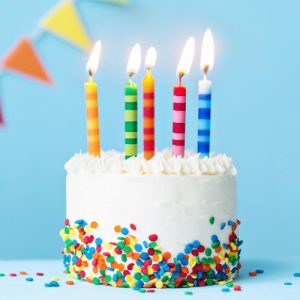
You are a GUI agent. You are given a task and a screenshot of the screen. Output one action in this format:
    pyautogui.click(x=<x>, y=<y>)
    Task: Click on the candle
    
    Given the screenshot: What is the action you would take?
    pyautogui.click(x=88, y=130), pyautogui.click(x=131, y=129), pyautogui.click(x=151, y=128), pyautogui.click(x=174, y=127), pyautogui.click(x=212, y=123)